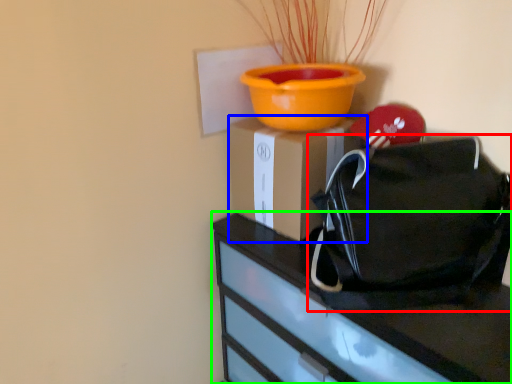
Question: Which object is positioned closest to handbag (highlighted by a red box)? Select from cardboard box (highlighted by a blue box) and furniture (highlighted by a green box).

Choices:
 (A) cardboard box
 (B) furniture

Answer: (B)